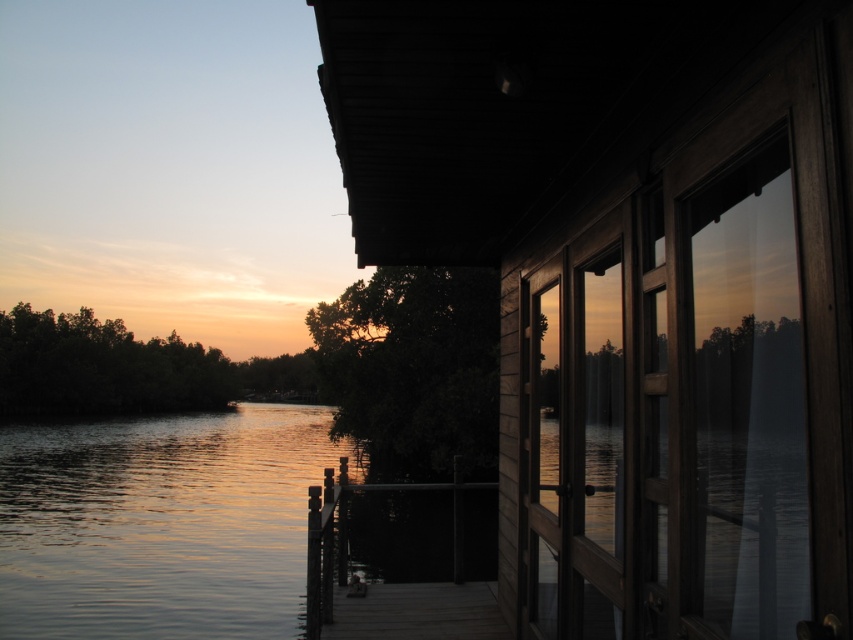
Looking at this image, which of these two, wooden cabin at right or glistening water at lower left, stands taller?

glistening water at lower left

Image resolution: width=853 pixels, height=640 pixels. What do you see at coordinates (633, 285) in the screenshot? I see `wooden cabin at right` at bounding box center [633, 285].

Identify the location of wooden cabin at right. (633, 285).

What do you see at coordinates (160, 524) in the screenshot? I see `glistening water at lower left` at bounding box center [160, 524].

What do you see at coordinates (160, 524) in the screenshot? Image resolution: width=853 pixels, height=640 pixels. I see `glistening water at lower left` at bounding box center [160, 524].

The width and height of the screenshot is (853, 640). What are the coordinates of `glistening water at lower left` in the screenshot? It's located at [160, 524].

Between point (814, 490) and point (312, 520), which one is positioned in front?

Positioned in front is point (814, 490).

Can you confirm if wooden cabin at right is bigger than wooden dock at center?

Actually, wooden cabin at right might be smaller than wooden dock at center.

Which is in front, point (534, 227) or point (312, 566)?

Point (312, 566)

Locate an element on the screen. wooden cabin at right is located at coordinates (633, 285).